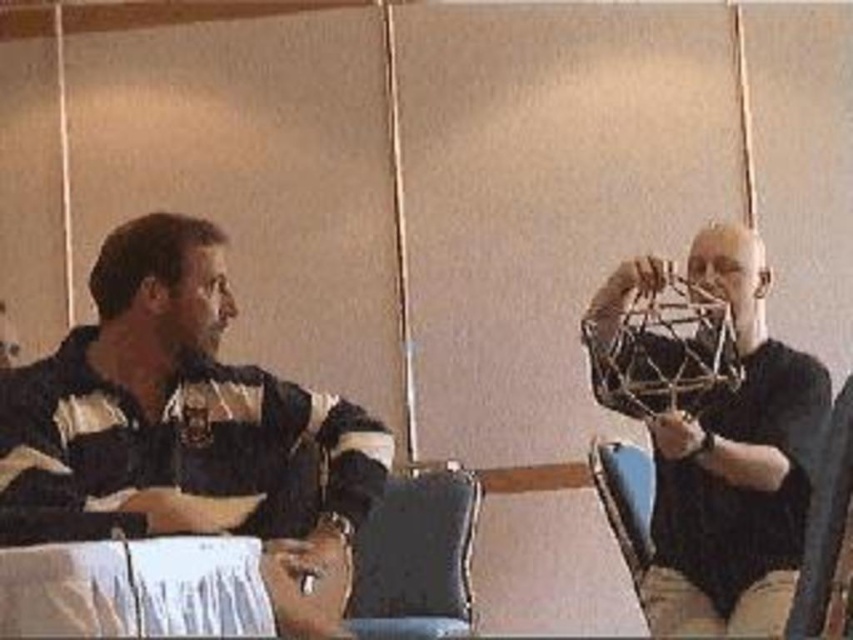
Is striped jersey shirt at left above metallic gold geometric structure at right?

Yes, striped jersey shirt at left is above metallic gold geometric structure at right.

Between striped jersey shirt at left and metallic gold geometric structure at right, which one is positioned lower?

metallic gold geometric structure at right is lower down.

Find the location of a particular element. striped jersey shirt at left is located at coordinates (184, 428).

Does striped jersey shirt at left appear on the right side of dark gray fabric chair at lower center?

No, striped jersey shirt at left is not to the right of dark gray fabric chair at lower center.

Is striped jersey shirt at left smaller than dark gray fabric chair at lower center?

Incorrect, striped jersey shirt at left is not smaller in size than dark gray fabric chair at lower center.

I want to click on striped jersey shirt at left, so click(184, 428).

Can you confirm if metallic gold geometric structure at right is positioned to the right of dark gray fabric chair at lower center?

Yes, metallic gold geometric structure at right is to the right of dark gray fabric chair at lower center.

Is metallic gold geometric structure at right behind dark gray fabric chair at lower center?

No, metallic gold geometric structure at right is in front of dark gray fabric chair at lower center.

This screenshot has height=640, width=853. Describe the element at coordinates (733, 464) in the screenshot. I see `metallic gold geometric structure at right` at that location.

Identify the location of metallic gold geometric structure at right. (733, 464).